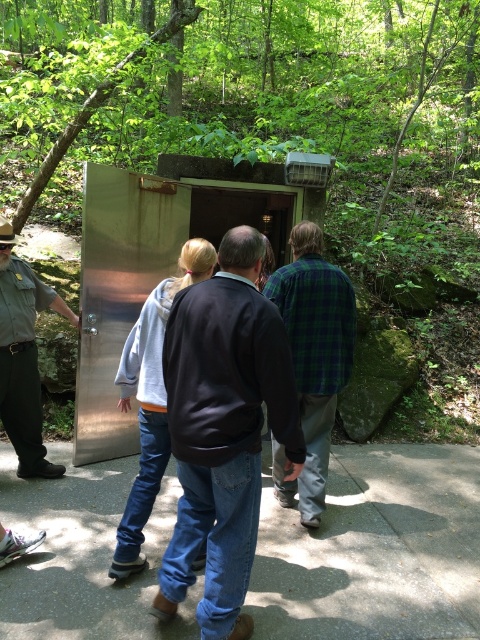
Can you confirm if dark blue sweater at center is positioned below green plaid shirt at center?

Correct, dark blue sweater at center is located below green plaid shirt at center.

Between dark blue sweater at center and green plaid shirt at center, which one appears on the right side from the viewer's perspective?

green plaid shirt at center

Which is behind, point (183, 323) or point (325, 477)?

The point (325, 477) is more distant.

Where is `dark blue sweater at center`? dark blue sweater at center is located at coordinates (224, 429).

Who is higher up, green plaid shirt at center or brushed metal uniform at left?

brushed metal uniform at left

Does green plaid shirt at center have a lesser height compared to brushed metal uniform at left?

No.

Image resolution: width=480 pixels, height=640 pixels. What do you see at coordinates (312, 358) in the screenshot?
I see `green plaid shirt at center` at bounding box center [312, 358].

Image resolution: width=480 pixels, height=640 pixels. Find the location of `green plaid shirt at center`. green plaid shirt at center is located at coordinates [312, 358].

Does concrete pavement at center come in front of dark blue sweater at center?

No, concrete pavement at center is further to the viewer.

How distant is concrete pavement at center from dark blue sweater at center?

concrete pavement at center and dark blue sweater at center are 3.77 feet apart.

Which is behind, point (349, 472) or point (266, 330)?

The point (349, 472) is behind.

Locate an element on the screen. concrete pavement at center is located at coordinates (374, 548).